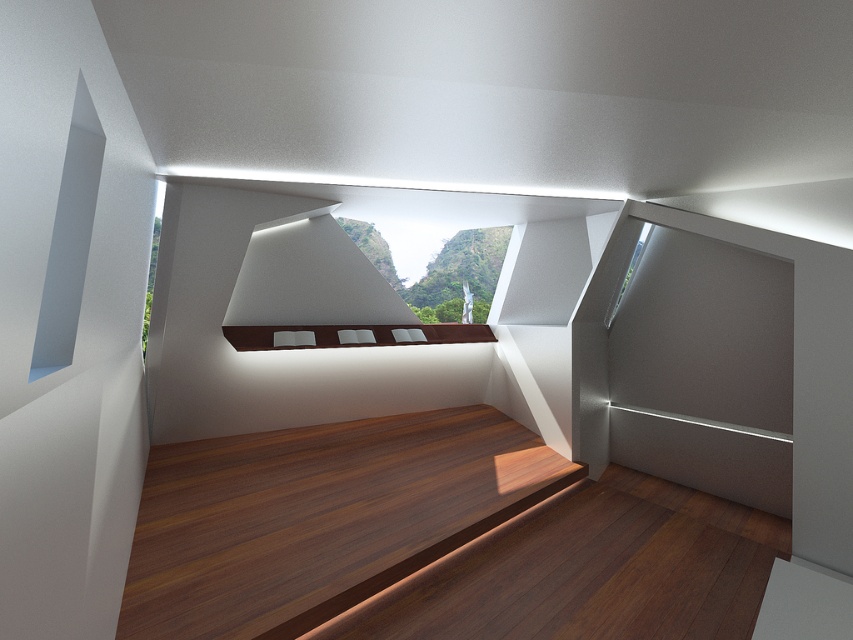
From the picture: You are designing a layout for a small living room and need to place a sofa. You have the brown matte bench at center and the clear glass window at upper right in the space. Considering their sizes, which object would require more horizontal space for placement?

The brown matte bench at center requires more horizontal space because its width is larger than that of the clear glass window at upper right.

You are a visitor in this modern interior space and want to sit on the brown matte bench at center. Can you see the clear glass window at upper right from there?

The brown matte bench at center is not as tall as clear glass window at upper right, so yes, you can see the clear glass window at upper right from there because the bench is shorter than the window.